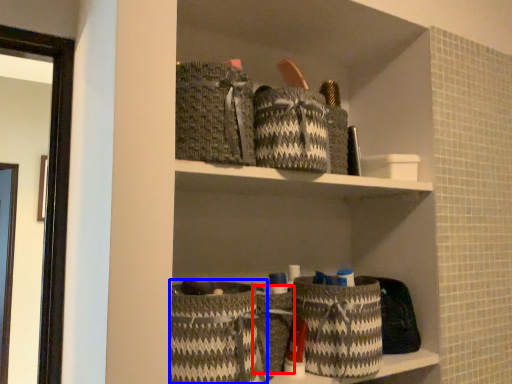
Question: Which of the following is the farthest to the observer, basket (highlighted by a red box) or basket (highlighted by a blue box)?

Choices:
 (A) basket
 (B) basket

Answer: (A)